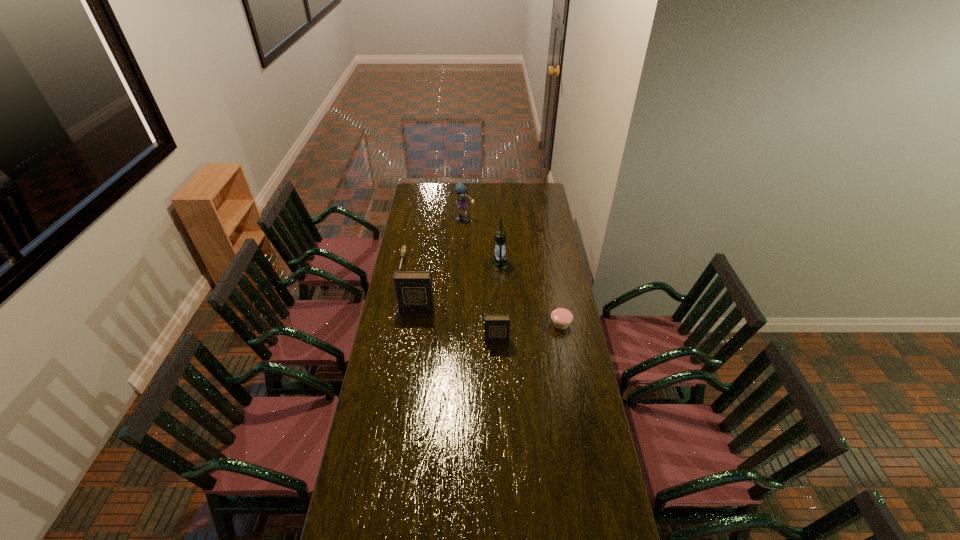
The image size is (960, 540). I want to click on screwdriver located at the left edge, so [x=403, y=250].

Identify the location of object that is at the right edge. (561, 318).

Identify the location of vacant region at the far edge. The height and width of the screenshot is (540, 960). (460, 200).

In order to click on vacant region at the near edge in this screenshot , I will do `click(562, 517)`.

Identify the location of free space at the right edge of the desktop. (525, 206).

Where is `vacant space at the far left corner of the desktop`? vacant space at the far left corner of the desktop is located at coordinates (429, 196).

In order to click on vacant space at the far right corner of the desktop in this screenshot , I will do `click(542, 194)`.

Where is `vacant area that lies between the nearest object and the tallest object`? Image resolution: width=960 pixels, height=540 pixels. vacant area that lies between the nearest object and the tallest object is located at coordinates (498, 302).

Where is `free spot between the lantern and the left diary`? free spot between the lantern and the left diary is located at coordinates (458, 286).

Where is `free point between the lantern and the shorter diary`? The width and height of the screenshot is (960, 540). free point between the lantern and the shorter diary is located at coordinates (498, 302).